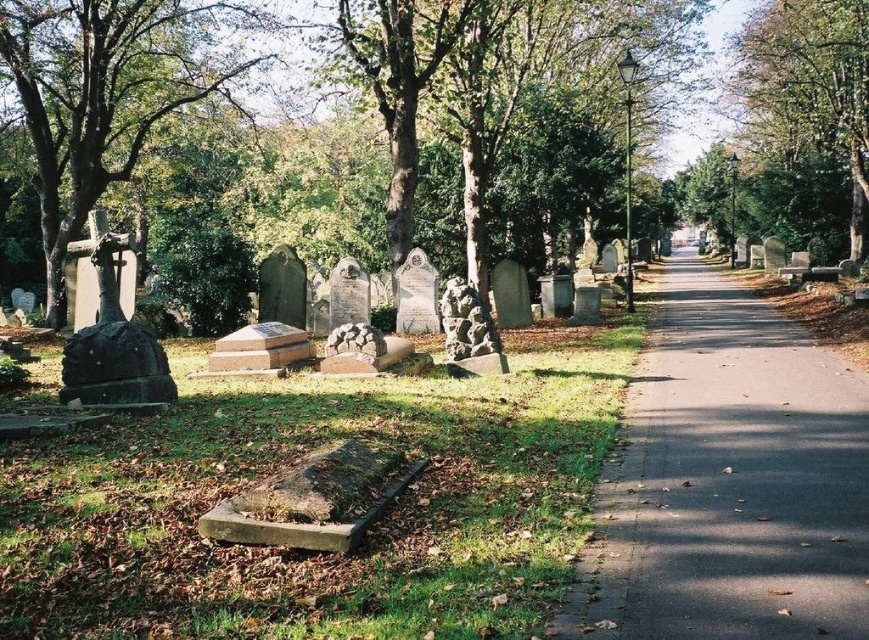
Question: Can you confirm if green leafy tree at left is smaller than green leafy tree at upper center?

Choices:
 (A) no
 (B) yes

Answer: (A)

Question: Is green leafy tree at left smaller than green leafy tree at upper center?

Choices:
 (A) no
 (B) yes

Answer: (A)

Question: Is green leafy tree at left further to the viewer compared to green leafy tree at upper center?

Choices:
 (A) yes
 (B) no

Answer: (B)

Question: Which point is closer to the camera?

Choices:
 (A) green leafy tree at left
 (B) green leafy tree at upper center

Answer: (A)